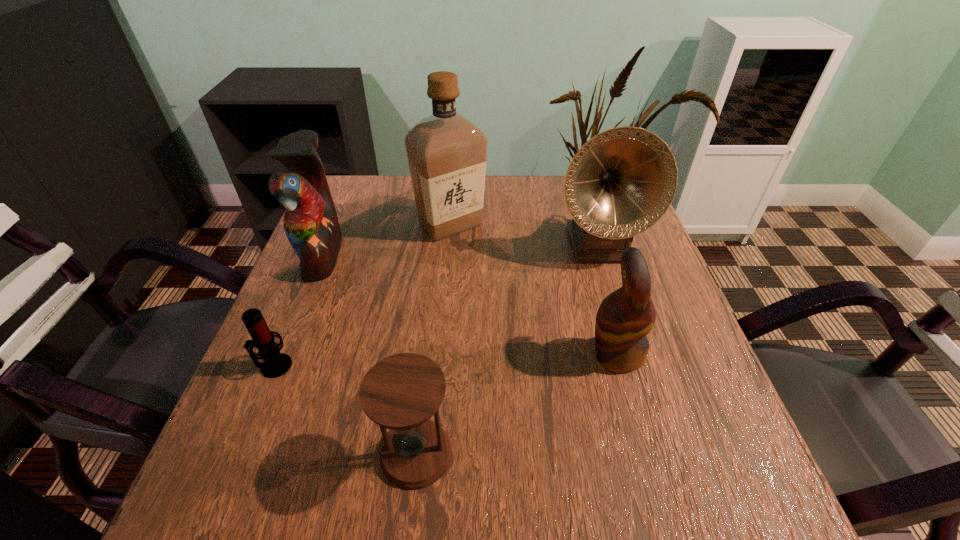
Where is `the tallest object`? The height and width of the screenshot is (540, 960). the tallest object is located at coordinates (446, 152).

Where is `phonograph record`? phonograph record is located at coordinates point(622,181).

Locate an element on the screen. the left parrot is located at coordinates (311, 225).

Locate an element on the screen. The height and width of the screenshot is (540, 960). the nearer parrot is located at coordinates (624, 318).

Identify the location of the second shortest object. (401, 392).

Locate an element on the screen. This screenshot has height=540, width=960. the nearest object is located at coordinates (401, 392).

Locate an element on the screen. This screenshot has height=540, width=960. microphone is located at coordinates (276, 364).

Where is `vacant region located 0.150m on the front-facing side of the liquor`? The height and width of the screenshot is (540, 960). vacant region located 0.150m on the front-facing side of the liquor is located at coordinates pos(445,287).

You are a GUI agent. You are given a task and a screenshot of the screen. Output one action in this format:
    pyautogui.click(x=<x>, y=<y>)
    Task: Click on the vacant space located on the horn of the phonograph record
    This screenshot has height=540, width=960.
    Given the screenshot: What is the action you would take?
    pyautogui.click(x=631, y=350)

Image resolution: width=960 pixels, height=540 pixels. I want to click on vacant space positioned 0.330m at the face of the farther parrot, so click(476, 255).